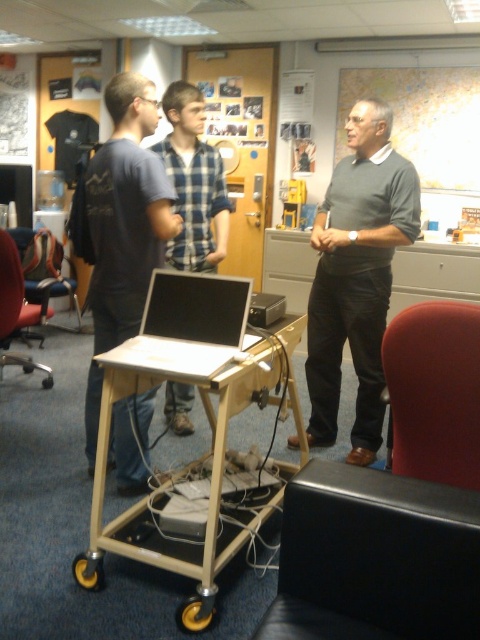
Question: In this image, where is light wood/matte table at center located relative to red leather swivel chair at lower right?

Choices:
 (A) right
 (B) left

Answer: (B)

Question: Is matte blue shirt at center bigger than silver metallic laptop at center?

Choices:
 (A) no
 (B) yes

Answer: (B)

Question: Can you confirm if gray sweater at center is bigger than silver metallic laptop at center?

Choices:
 (A) yes
 (B) no

Answer: (A)

Question: Based on their relative distances, which object is farther from the gray sweater at center?

Choices:
 (A) matte blue shirt at center
 (B) silver metallic laptop at center
 (C) red leather swivel chair at lower right
 (D) light wood/matte table at center

Answer: (C)

Question: Which point is closer to the camera taking this photo?

Choices:
 (A) (326, 548)
 (B) (288, 445)
 (C) (216, 177)
 (D) (132, 321)

Answer: (A)

Question: Which of these objects is positioned farthest from the light wood/matte table at center?

Choices:
 (A) black leather swivel chair at lower right
 (B) silver metallic laptop at center

Answer: (A)